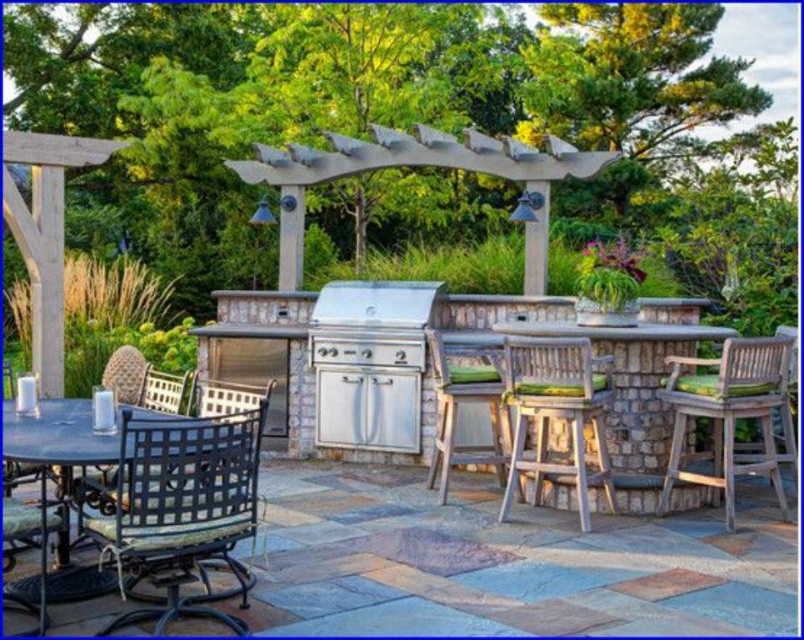
Question: Which point appears farthest from the camera in this image?

Choices:
 (A) (335, 141)
 (B) (691, 353)
 (C) (109, 468)
 (D) (146, 499)

Answer: (A)

Question: Is teak wood table at center above metallic dark brown table at lower left?

Choices:
 (A) yes
 (B) no

Answer: (B)

Question: Which point is farther to the camera?

Choices:
 (A) metallic woven chair at center
 (B) metallic dark brown table at lower left

Answer: (A)

Question: Can you confirm if teak wood table at center is bigger than teak wood bar stool at right?

Choices:
 (A) yes
 (B) no

Answer: (A)

Question: Considering the real-world distances, which object is closest to the metallic mesh chair at lower left?

Choices:
 (A) teak wood bar stool at right
 (B) metallic black chair at lower left
 (C) teak wood table at center

Answer: (B)

Question: Is metallic mesh chair at lower left above teak wood bar stool at right?

Choices:
 (A) no
 (B) yes

Answer: (A)